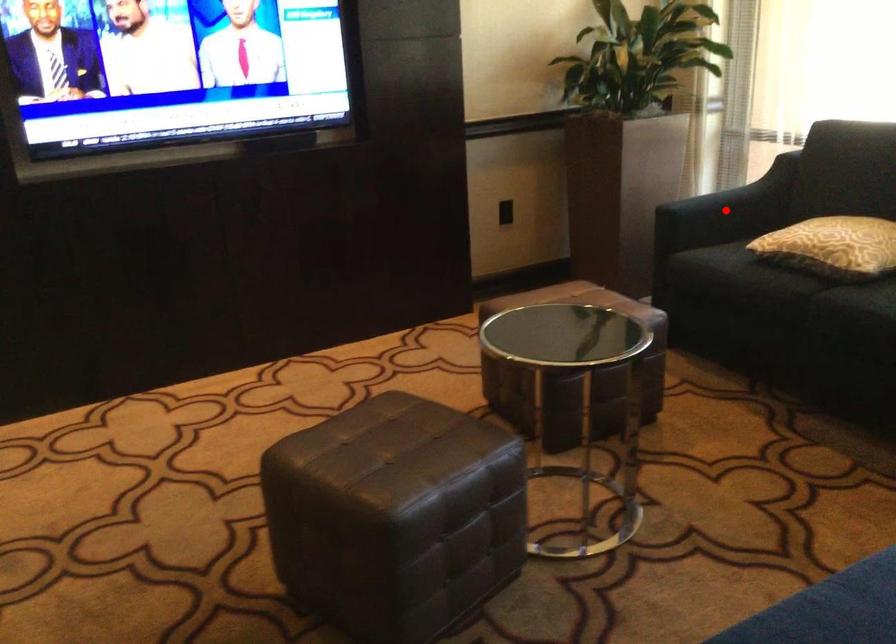
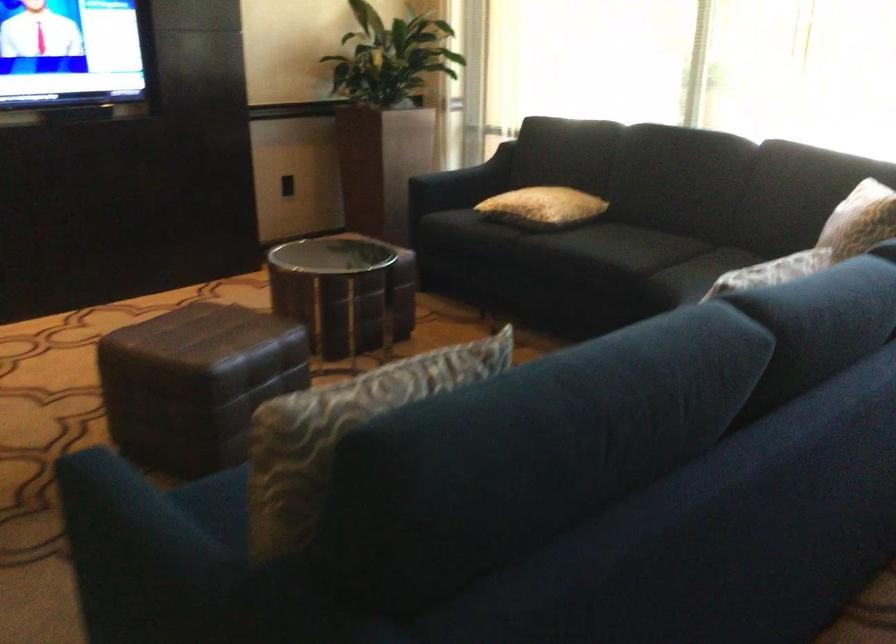
The point at the highlighted location is marked in the first image. Where is the corresponding point in the second image?

(460, 184)